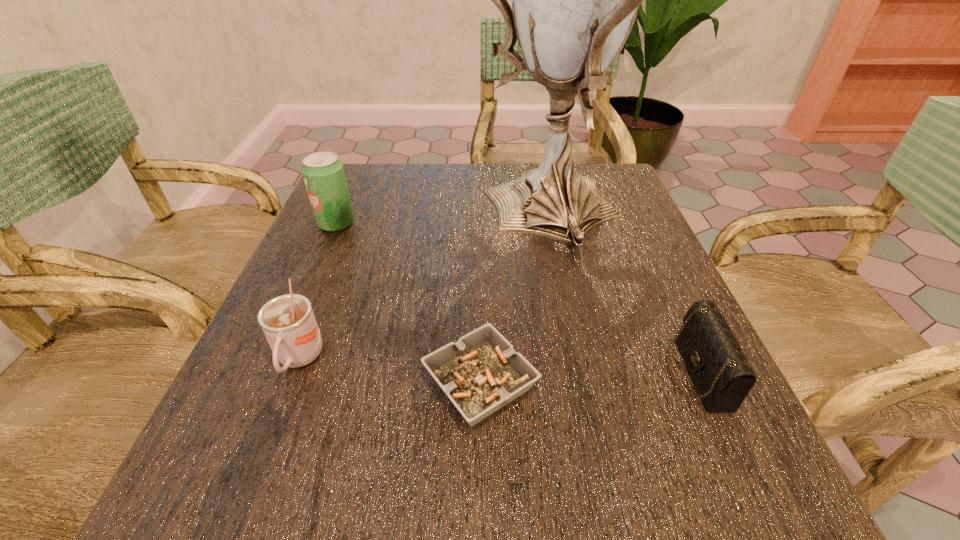
This screenshot has width=960, height=540. Identify the location of the tallest object. pos(575,0).

Locate an element on the screen. the second tallest object is located at coordinates point(323,173).

Where is `the third shortest object`? the third shortest object is located at coordinates (288, 322).

In order to click on the fourth tallest object in this screenshot , I will do `click(722, 375)`.

What are the coordinates of `the shortest object` in the screenshot? It's located at (480, 373).

Locate an element on the screen. The image size is (960, 540). vacant area situated 0.270m on the front of the trophy cup is located at coordinates (586, 389).

The height and width of the screenshot is (540, 960). In order to click on vacant space situated 0.100m on the right of the soda in this screenshot , I will do `click(399, 224)`.

Locate an element on the screen. This screenshot has width=960, height=540. free spot located on the side with the handle of the third shortest object is located at coordinates (233, 530).

Where is `free spot located on the front flap of the clutch bag`? This screenshot has height=540, width=960. free spot located on the front flap of the clutch bag is located at coordinates (636, 373).

Find the location of `vacant space situated on the front flap of the clutch bag`. vacant space situated on the front flap of the clutch bag is located at coordinates click(x=460, y=373).